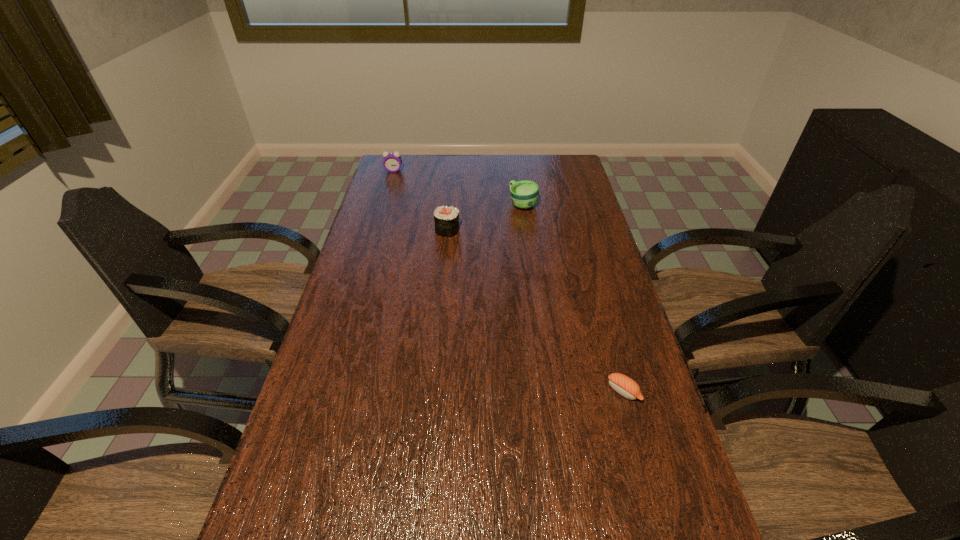
Image resolution: width=960 pixels, height=540 pixels. I want to click on vacant position in the image that satisfies the following two spatial constraints: 1. on the face of the farthest object; 2. on the left side of the taller sushi, so click(x=376, y=230).